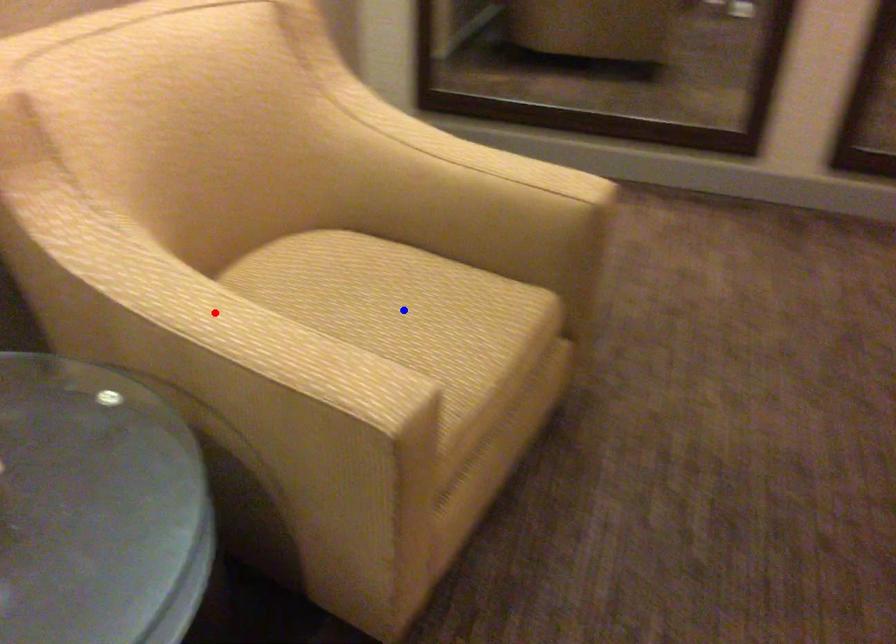
Question: Two points are marked on the image. Which point is closer to the camera?

Choices:
 (A) Blue point is closer.
 (B) Red point is closer.

Answer: (B)